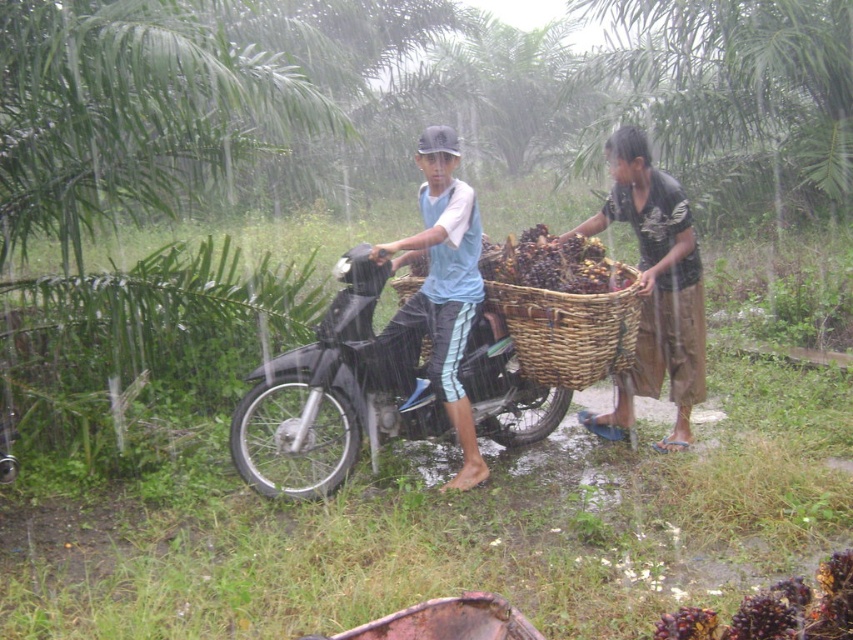
Question: Is brown woven basket at right positioned before light blue fabric shirt at center?

Choices:
 (A) yes
 (B) no

Answer: (B)

Question: Does black matte motorcycle at center appear over matte wicker basket at center?

Choices:
 (A) no
 (B) yes

Answer: (A)

Question: Among these points, which one is nearest to the camera?

Choices:
 (A) (587, 422)
 (B) (474, 340)
 (C) (653, 204)
 (D) (461, 476)

Answer: (D)

Question: Does matte wicker basket at center appear over woven brown basket at center?

Choices:
 (A) yes
 (B) no

Answer: (A)

Question: Based on their relative distances, which object is farther from the matte wicker basket at center?

Choices:
 (A) woven brown basket at center
 (B) light blue fabric shirt at center

Answer: (B)

Question: Which of the following is the farthest from the observer?

Choices:
 (A) brown woven basket at right
 (B) light blue fabric shirt at center
 (C) matte wicker basket at center
 (D) woven brown basket at center

Answer: (A)